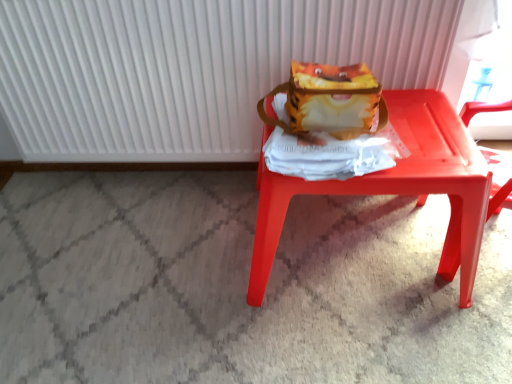
Question: From the image's perspective, is matte plastic stool at center located above or below matte yellow fabric shoulder bag at center?

Choices:
 (A) below
 (B) above

Answer: (A)

Question: Is matte plastic stool at center situated inside matte yellow fabric shoulder bag at center or outside?

Choices:
 (A) inside
 (B) outside

Answer: (B)

Question: Based on their relative distances, which object is farther from the white ribbed radiator at upper center?

Choices:
 (A) matte yellow fabric shoulder bag at center
 (B) matte plastic stool at center

Answer: (B)

Question: Estimate the real-world distances between objects in this image. Which object is closer to the matte plastic stool at center?

Choices:
 (A) white ribbed radiator at upper center
 (B) matte yellow fabric shoulder bag at center

Answer: (B)